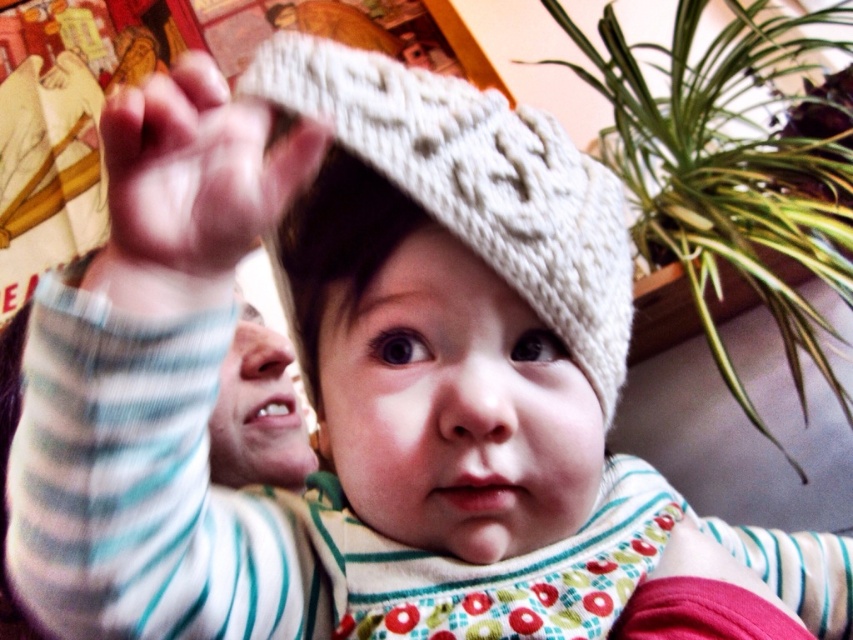
From the picture: You are a parent holding a baby who is reaching for the green leafy plant at upper right. The baby is currently 24 inches tall. Can the baby reach the plant if they stand on their toes?

The green leafy plant at upper right is 31.17 inches away from the viewer. Since the baby is 24 inches tall, standing on their toes might add a few inches, but it is unlikely they can reach the plant which is 31.17 inches away.

You are holding a toy that is 12 inches long and want to place it so the baby can see it. The baby is looking at the point labeled as point (752, 276). Can you place the toy within 30 inches of that point so the baby can easily reach it?

The point (752, 276) is 37.79 inches away from the viewer. Since the toy needs to be placed within 30 inches of that point, the distance from the viewer would be 37.79 minus 30 equals 7.79 inches. Therefore, you should place the toy 7.79 inches away from your current position towards the point (752, 276) for the baby to reach it easily.